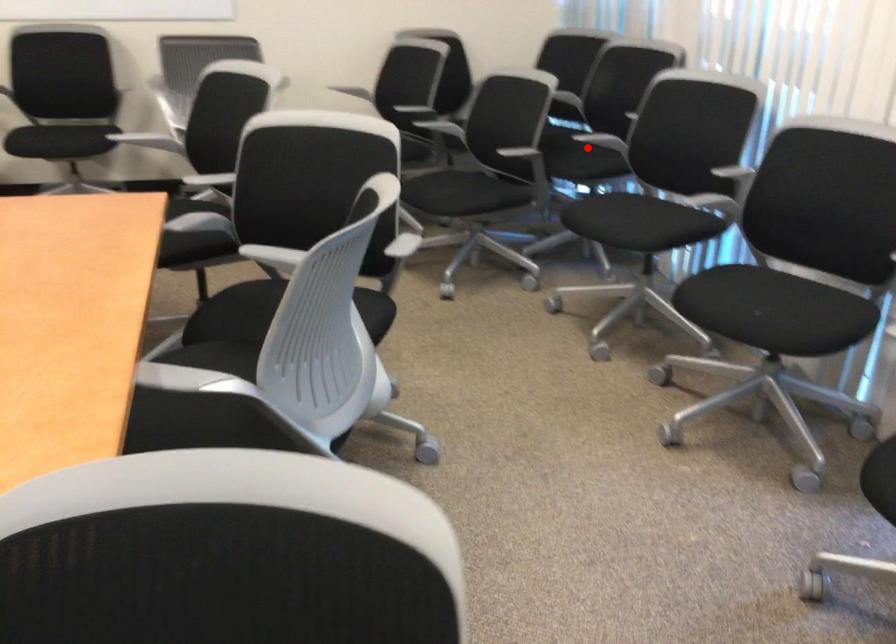
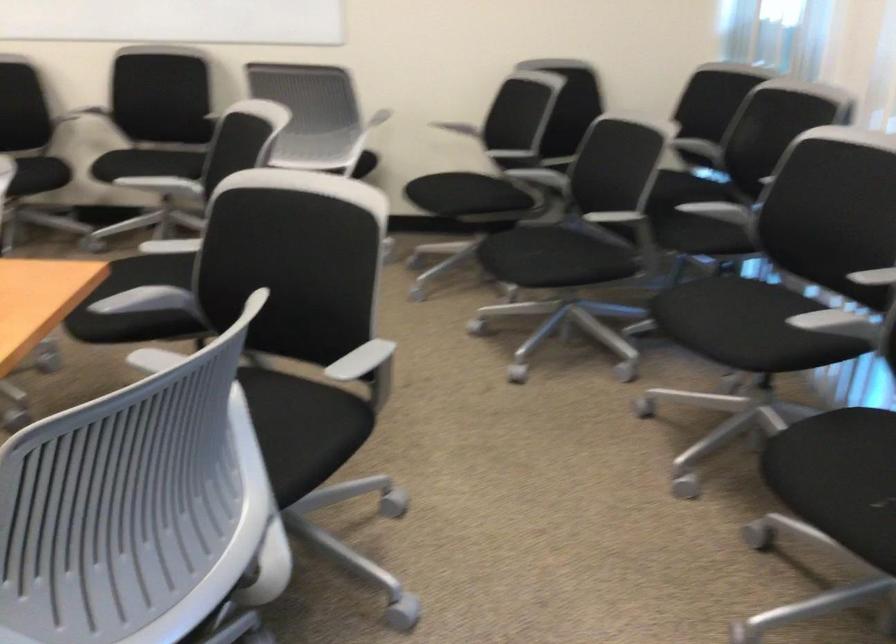
Question: I am providing you with two images of the same scene from different viewpoints. A red point is marked on the first image. Is the red point's position out of view in image 2?

Choices:
 (A) Yes
 (B) No

Answer: (A)